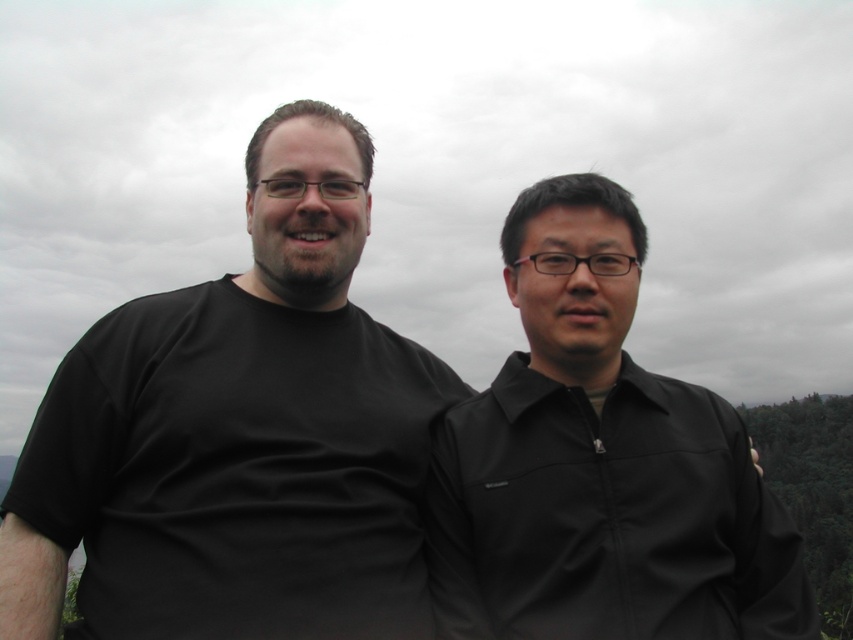
Question: Which point is farther from the camera taking this photo?

Choices:
 (A) (462, 545)
 (B) (230, 547)

Answer: (A)

Question: Does black matte t-shirt at left have a smaller size compared to black matte shirt at right?

Choices:
 (A) no
 (B) yes

Answer: (B)

Question: Can you confirm if black matte t-shirt at left is wider than black matte shirt at right?

Choices:
 (A) yes
 (B) no

Answer: (A)

Question: Does black matte t-shirt at left appear on the right side of black matte shirt at right?

Choices:
 (A) yes
 (B) no

Answer: (B)

Question: Which point is farther to the camera?

Choices:
 (A) black matte t-shirt at left
 (B) black matte shirt at right

Answer: (B)